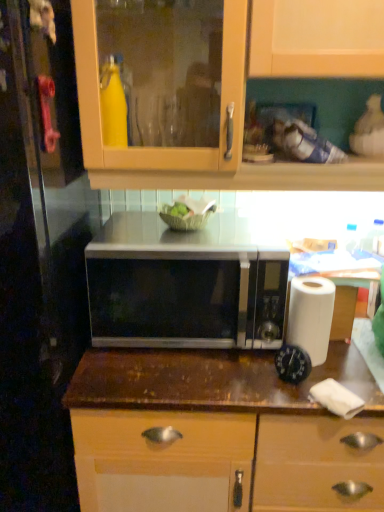
Identify the location of vacant space in front of satin silver microwave at center. Image resolution: width=384 pixels, height=512 pixels. (183, 380).